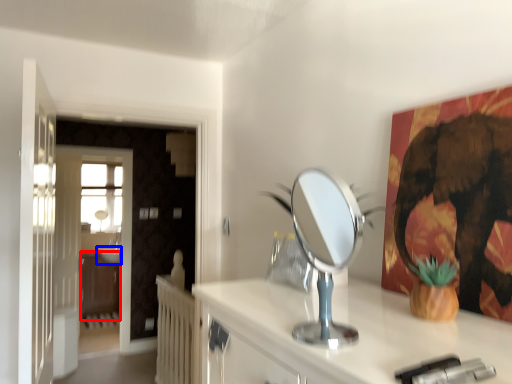
Question: Which point is closer to the camera, dresser (highlighted by a red box) or sink (highlighted by a blue box)?

Choices:
 (A) dresser
 (B) sink

Answer: (A)